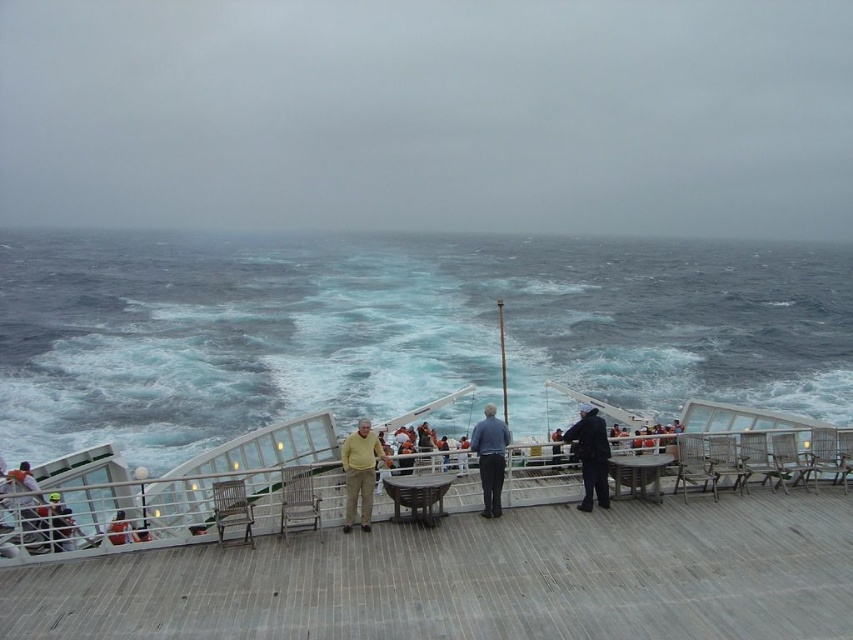
You are standing on the ship deck and want to place a new chair. You have a clear view of the blue water at center and the orange life vest at lower left. Which object is closer to you, the observer?

The orange life vest at lower left is closer to you because the blue water at center is further away.

You are standing on the deck of a ship and see the yellow knit sweater at center and the dark blue jacket at center. Which one is positioned more to the left side?

The yellow knit sweater at center is positioned to the left of the dark blue jacket at center, so it is more to the left side.

You are standing on the ship deck and want to take a photo of both point (103, 276) and point (585, 435) in the same frame. Which point should you focus on first to ensure both are in focus?

You should focus on point (103, 276) first because it is closer to the camera than point (585, 435). This ensures both points will be within the depth of field and in focus.